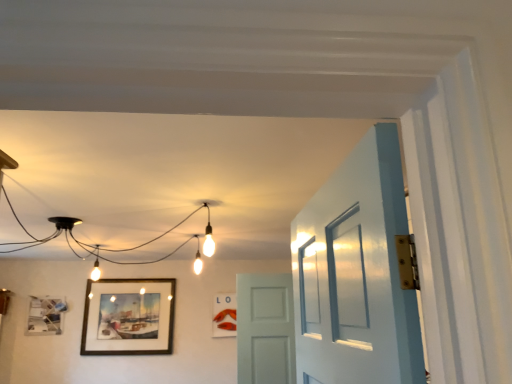
Question: Is white matte door at center completely or partially outside of wooden framed painting at lower left, which is counted as the second picture frame, starting from the right?

Choices:
 (A) no
 (B) yes

Answer: (B)

Question: From a real-world perspective, is white matte door at center on top of wooden framed painting at lower left, which is counted as the second picture frame, starting from the right?

Choices:
 (A) no
 (B) yes

Answer: (A)

Question: Can you confirm if white matte door at center is taller than wooden framed painting at lower left, which is counted as the second picture frame, starting from the right?

Choices:
 (A) no
 (B) yes

Answer: (A)

Question: Can you see white matte door at center touching wooden framed painting at lower left, which is counted as the second picture frame, starting from the right?

Choices:
 (A) yes
 (B) no

Answer: (B)

Question: Does white matte door at center have a smaller size compared to wooden framed painting at lower left, which is counted as the second picture frame, starting from the right?

Choices:
 (A) no
 (B) yes

Answer: (A)

Question: Is white matte door at center in front of or behind matte wooden picture frame at center, the first picture frame when ordered from right to left, in the image?

Choices:
 (A) front
 (B) behind

Answer: (A)

Question: In terms of height, does white matte door at center look taller or shorter compared to matte wooden picture frame at center, the first picture frame when ordered from right to left?

Choices:
 (A) short
 (B) tall

Answer: (B)

Question: From the image's perspective, relative to matte wooden picture frame at center, which ranks as the 3th picture frame in left-to-right order, is white matte door at center above or below?

Choices:
 (A) above
 (B) below

Answer: (A)

Question: In terms of width, does white matte door at center look wider or thinner when compared to matte wooden picture frame at center, which ranks as the 3th picture frame in left-to-right order?

Choices:
 (A) wide
 (B) thin

Answer: (A)

Question: Is matte wooden picture frame at center, which ranks as the 3th picture frame in left-to-right order, wider or thinner than wooden framed painting at lower left, which is counted as the second picture frame, starting from the right?

Choices:
 (A) thin
 (B) wide

Answer: (B)

Question: Which is correct: matte wooden picture frame at center, the first picture frame when ordered from right to left, is inside wooden framed painting at lower left, acting as the second picture frame starting from the left, or outside of it?

Choices:
 (A) inside
 (B) outside

Answer: (B)

Question: From a real-world perspective, is matte wooden picture frame at center, the first picture frame when ordered from right to left, above or below wooden framed painting at lower left, acting as the second picture frame starting from the left?

Choices:
 (A) below
 (B) above

Answer: (A)

Question: From the image's perspective, is matte wooden picture frame at center, the first picture frame when ordered from right to left, located above or below wooden framed painting at lower left, acting as the second picture frame starting from the left?

Choices:
 (A) above
 (B) below

Answer: (B)

Question: Is wooden framed painting at lower left, which is counted as the second picture frame, starting from the right, situated inside white matte door at center or outside?

Choices:
 (A) outside
 (B) inside

Answer: (A)

Question: From their relative heights in the image, would you say wooden framed painting at lower left, acting as the second picture frame starting from the left, is taller or shorter than white matte door at center?

Choices:
 (A) short
 (B) tall

Answer: (B)